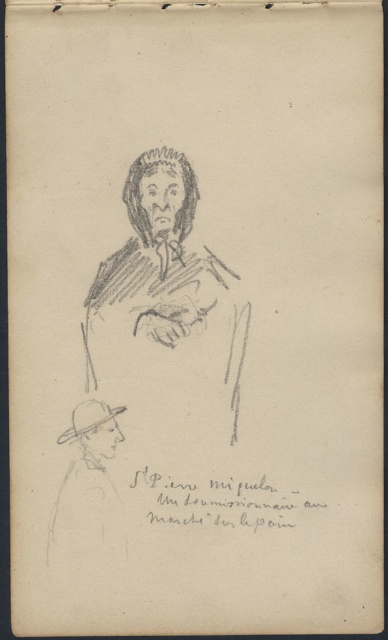
Question: Which of the following is the closest to the observer?

Choices:
 (A) (202, 269)
 (B) (100, 483)

Answer: (B)

Question: Which of the following is the closest to the observer?

Choices:
 (A) charcoal sketch figure at center
 (B) charcoal sketch of man at bottom left

Answer: (B)

Question: Observing the image, what is the correct spatial positioning of charcoal sketch figure at center in reference to charcoal sketch of man at bottom left?

Choices:
 (A) above
 (B) below

Answer: (A)

Question: Does charcoal sketch figure at center have a lesser width compared to charcoal sketch of man at bottom left?

Choices:
 (A) no
 (B) yes

Answer: (A)

Question: Is charcoal sketch figure at center wider than charcoal sketch of man at bottom left?

Choices:
 (A) no
 (B) yes

Answer: (B)

Question: Which point is farther from the camera taking this photo?

Choices:
 (A) (176, 310)
 (B) (98, 452)

Answer: (A)